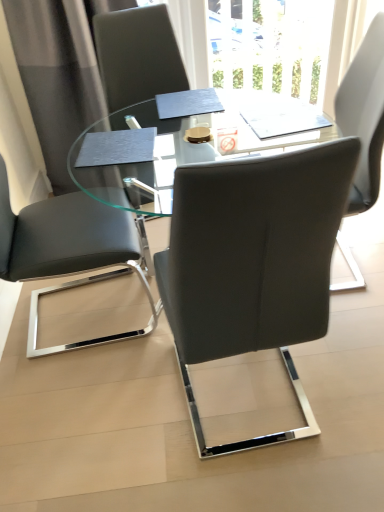
Locate an element on the screen. gray fabric curtain at upper left is located at coordinates (59, 72).

You are a GUI agent. You are given a task and a screenshot of the screen. Output one action in this format:
    pyautogui.click(x=<x>, y=<y>)
    Task: Click on the matte black chair at left, the 1th chair when ordered from left to right
    The width and height of the screenshot is (384, 512).
    Given the screenshot: What is the action you would take?
    pyautogui.click(x=68, y=251)

Can gray fabric curtain at upper left be found inside matte black chair at left, the 1th chair when ordered from left to right?

No, gray fabric curtain at upper left is not inside matte black chair at left, the 1th chair when ordered from left to right.

From a real-world perspective, between matte black chair at left, the 1th chair when ordered from left to right, and gray fabric curtain at upper left, who is vertically lower?

matte black chair at left, the 1th chair when ordered from left to right, is physically lower.

Which object is more forward, matte black chair at left, the 1th chair when ordered from left to right, or gray fabric curtain at upper left?

matte black chair at left, the 1th chair when ordered from left to right.

Which is less distant, (25, 213) or (38, 42)?

The point (25, 213) is in front.

Find the location of a particular element. table in front of the gray fabric curtain at upper left is located at coordinates (144, 149).

What's the angular difference between gray fabric curtain at upper left and transparent glass table at center's facing directions?

94.8 degrees.

Who is bigger, gray fabric curtain at upper left or transparent glass table at center?

With larger size is transparent glass table at center.

Would you say transparent glass table at center is part of gray fabric curtain at upper left's contents?

That's incorrect, transparent glass table at center is not inside gray fabric curtain at upper left.

From the image's perspective, which object appears higher, matte black chair at left, the 1th chair when ordered from left to right, or transparent glass table at center?

matte black chair at left, the 1th chair when ordered from left to right.

Locate an element on the screen. The width and height of the screenshot is (384, 512). chair that is the 1st one above the transparent glass table at center (from a real-world perspective) is located at coordinates (68, 251).

From the picture: From a real-world perspective, is matte black chair at left, acting as the 2th chair starting from the right, physically located above or below transparent glass table at center?

matte black chair at left, acting as the 2th chair starting from the right, is situated higher than transparent glass table at center in the real world.

Does matte black chair at left, the 1th chair when ordered from left to right, have a lesser width compared to transparent glass table at center?

Correct, the width of matte black chair at left, the 1th chair when ordered from left to right, is less than that of transparent glass table at center.

From a real-world perspective, who is located higher, matte black chair at left, the 1th chair when ordered from left to right, or matte gray chair at center, which is the second chair in left-to-right order?

From a 3D spatial view, matte gray chair at center, which is the second chair in left-to-right order, is above.

Between matte black chair at left, the 1th chair when ordered from left to right, and matte gray chair at center, which is the 1th chair from right to left, which one has less height?

With less height is matte black chair at left, the 1th chair when ordered from left to right.

Consider the image. From the image's perspective, is matte black chair at left, acting as the 2th chair starting from the right, located above matte gray chair at center, which is the second chair in left-to-right order?

Yes, from the image's perspective, matte black chair at left, acting as the 2th chair starting from the right, is on top of matte gray chair at center, which is the second chair in left-to-right order.

Is matte black chair at left, the 1th chair when ordered from left to right, inside or outside of matte gray chair at center, which is the second chair in left-to-right order?

matte black chair at left, the 1th chair when ordered from left to right, is not enclosed by matte gray chair at center, which is the second chair in left-to-right order.

Locate an element on the screen. The image size is (384, 512). chair that appears on the right of gray fabric curtain at upper left is located at coordinates (253, 263).

Considering the positions of objects gray fabric curtain at upper left and matte gray chair at center, which is the second chair in left-to-right order, in the image provided, who is more to the left, gray fabric curtain at upper left or matte gray chair at center, which is the second chair in left-to-right order,?

gray fabric curtain at upper left is more to the left.

From a real-world perspective, does gray fabric curtain at upper left sit lower than matte gray chair at center, which is the 1th chair from right to left?

No.

What's the angular difference between gray fabric curtain at upper left and matte gray chair at center, which is the second chair in left-to-right order,'s facing directions?

174 degrees separate the facing orientations of gray fabric curtain at upper left and matte gray chair at center, which is the second chair in left-to-right order.

Which is more to the right, matte gray chair at center, which is the 1th chair from right to left, or transparent glass table at center?

Positioned to the right is matte gray chair at center, which is the 1th chair from right to left.

You are a GUI agent. You are given a task and a screenshot of the screen. Output one action in this format:
    pyautogui.click(x=<x>, y=<y>)
    Task: Click on the chair below the transparent glass table at center (from the image's perspective)
    The image size is (384, 512).
    Given the screenshot: What is the action you would take?
    pyautogui.click(x=253, y=263)

From a real-world perspective, is matte gray chair at center, which is the second chair in left-to-right order, below transparent glass table at center?

Incorrect, from a real-world perspective, matte gray chair at center, which is the second chair in left-to-right order, is higher than transparent glass table at center.

Can you confirm if matte gray chair at center, which is the 1th chair from right to left, is shorter than transparent glass table at center?

→ No, matte gray chair at center, which is the 1th chair from right to left, is not shorter than transparent glass table at center.

Can you confirm if matte gray chair at center, which is the 1th chair from right to left, is bigger than matte black chair at left, the 1th chair when ordered from left to right?

Actually, matte gray chair at center, which is the 1th chair from right to left, might be smaller than matte black chair at left, the 1th chair when ordered from left to right.

Considering the sizes of objects matte gray chair at center, which is the 1th chair from right to left, and matte black chair at left, the 1th chair when ordered from left to right, in the image provided, who is taller, matte gray chair at center, which is the 1th chair from right to left, or matte black chair at left, the 1th chair when ordered from left to right,?

With more height is matte gray chair at center, which is the 1th chair from right to left.

Considering the positions of objects matte gray chair at center, which is the second chair in left-to-right order, and matte black chair at left, acting as the 2th chair starting from the right, in the image provided, who is more to the right, matte gray chair at center, which is the second chair in left-to-right order, or matte black chair at left, acting as the 2th chair starting from the right,?

Positioned to the right is matte gray chair at center, which is the second chair in left-to-right order.

Is matte gray chair at center, which is the 1th chair from right to left, next to matte black chair at left, the 1th chair when ordered from left to right?

No, matte gray chair at center, which is the 1th chair from right to left, is not touching matte black chair at left, the 1th chair when ordered from left to right.

Locate an element on the screen. The width and height of the screenshot is (384, 512). curtain on the right of matte black chair at left, acting as the 2th chair starting from the right is located at coordinates click(59, 72).

You are a GUI agent. You are given a task and a screenshot of the screen. Output one action in this format:
    pyautogui.click(x=<x>, y=<y>)
    Task: Click on the table located underneath the gray fabric curtain at upper left (from a real-world perspective)
    
    Given the screenshot: What is the action you would take?
    pyautogui.click(x=144, y=149)

Based on their spatial positions, is gray fabric curtain at upper left or matte gray chair at center, which is the second chair in left-to-right order, closer to transparent glass table at center?

Among the two, gray fabric curtain at upper left is located nearer to transparent glass table at center.

When comparing their distances from matte gray chair at center, which is the second chair in left-to-right order, does matte black chair at left, acting as the 2th chair starting from the right, or transparent glass table at center seem closer?

Among the two, matte black chair at left, acting as the 2th chair starting from the right, is located nearer to matte gray chair at center, which is the second chair in left-to-right order.

Estimate the real-world distances between objects in this image. Which object is further from transparent glass table at center, matte gray chair at center, which is the 1th chair from right to left, or matte black chair at left, the 1th chair when ordered from left to right?

Based on the image, matte gray chair at center, which is the 1th chair from right to left, appears to be further to transparent glass table at center.

Based on their spatial positions, is matte black chair at left, acting as the 2th chair starting from the right, or matte gray chair at center, which is the second chair in left-to-right order, further from gray fabric curtain at upper left?

matte gray chair at center, which is the second chair in left-to-right order, is further to gray fabric curtain at upper left.

Which object lies further to the anchor point transparent glass table at center, matte black chair at left, the 1th chair when ordered from left to right, or gray fabric curtain at upper left?

gray fabric curtain at upper left lies further to transparent glass table at center than the other object.

Considering their positions, is transparent glass table at center positioned further to matte gray chair at center, which is the 1th chair from right to left, than matte black chair at left, acting as the 2th chair starting from the right?

transparent glass table at center is positioned further to the anchor matte gray chair at center, which is the 1th chair from right to left.

Estimate the real-world distances between objects in this image. Which object is closer to matte gray chair at center, which is the second chair in left-to-right order, matte black chair at left, the 1th chair when ordered from left to right, or gray fabric curtain at upper left?

Among the two, matte black chair at left, the 1th chair when ordered from left to right, is located nearer to matte gray chair at center, which is the second chair in left-to-right order.

Estimate the real-world distances between objects in this image. Which object is further from matte black chair at left, the 1th chair when ordered from left to right, transparent glass table at center or gray fabric curtain at upper left?

gray fabric curtain at upper left is further to matte black chair at left, the 1th chair when ordered from left to right.

You are a GUI agent. You are given a task and a screenshot of the screen. Output one action in this format:
    pyautogui.click(x=<x>, y=<y>)
    Task: Click on the chair between matte gray chair at center, which is the 1th chair from right to left, and gray fabric curtain at upper left from front to back
    This screenshot has width=384, height=512.
    Given the screenshot: What is the action you would take?
    pyautogui.click(x=68, y=251)

Locate an element on the screen. The height and width of the screenshot is (512, 384). table between matte black chair at left, acting as the 2th chair starting from the right, and matte gray chair at center, which is the second chair in left-to-right order is located at coordinates (144, 149).

Locate an element on the screen. The image size is (384, 512). table between matte gray chair at center, which is the 1th chair from right to left, and gray fabric curtain at upper left from front to back is located at coordinates (144, 149).

Identify the location of table between matte black chair at left, acting as the 2th chair starting from the right, and gray fabric curtain at upper left in the front-back direction. (144, 149).